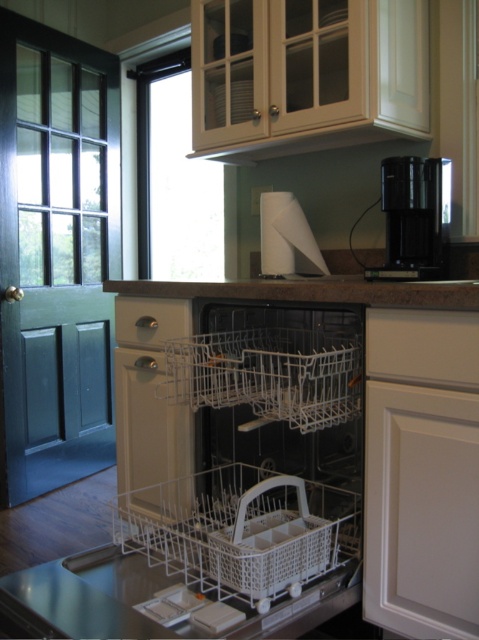
Question: Is white plastic dish washer at center to the left of black plastic coffee machine at upper right from the viewer's perspective?

Choices:
 (A) no
 (B) yes

Answer: (B)

Question: Does brown granite countertop at center come in front of black plastic coffee machine at upper right?

Choices:
 (A) yes
 (B) no

Answer: (A)

Question: Does white plastic basket at center appear over black plastic coffee machine at upper right?

Choices:
 (A) no
 (B) yes

Answer: (A)

Question: Which of the following is the closest to the observer?

Choices:
 (A) white plastic basket at center
 (B) black plastic coffee machine at upper right
 (C) brown granite countertop at center

Answer: (A)

Question: Among these objects, which one is nearest to the camera?

Choices:
 (A) white plastic basket at center
 (B) white plastic dish washer at center
 (C) black plastic coffee machine at upper right
 (D) brown granite countertop at center

Answer: (A)

Question: Which is nearer to the brown granite countertop at center?

Choices:
 (A) white plastic basket at center
 (B) white plastic dish washer at center

Answer: (B)